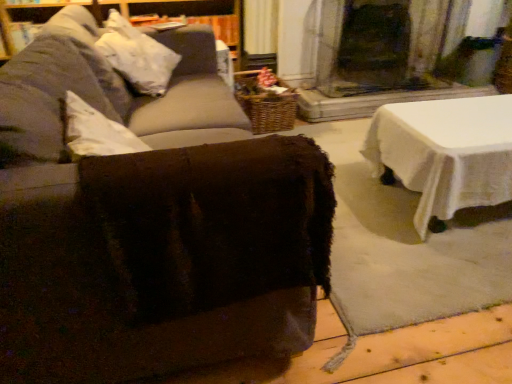
Question: Is white fabric pillow at upper left turned away from brown fuzzy ottoman at center?

Choices:
 (A) no
 (B) yes

Answer: (B)

Question: From the image's perspective, is white fabric pillow at upper left located above brown fuzzy ottoman at center?

Choices:
 (A) yes
 (B) no

Answer: (A)

Question: From the image's perspective, is white fabric pillow at upper left under brown fuzzy ottoman at center?

Choices:
 (A) yes
 (B) no

Answer: (B)

Question: Is white fabric pillow at upper left outside of brown fuzzy ottoman at center?

Choices:
 (A) no
 (B) yes

Answer: (A)

Question: Is white fabric pillow at upper left smaller than brown fuzzy ottoman at center?

Choices:
 (A) yes
 (B) no

Answer: (A)

Question: In terms of height, does white fabric pillow at upper left look taller or shorter compared to woven brown basket at center?

Choices:
 (A) short
 (B) tall

Answer: (B)

Question: Would you say white fabric pillow at upper left is to the left or to the right of woven brown basket at center in the picture?

Choices:
 (A) right
 (B) left

Answer: (B)

Question: From the image's perspective, is white fabric pillow at upper left above or below woven brown basket at center?

Choices:
 (A) below
 (B) above

Answer: (B)

Question: Is white fabric pillow at upper left spatially inside woven brown basket at center, or outside of it?

Choices:
 (A) inside
 (B) outside

Answer: (B)

Question: In the image, is brown fuzzy ottoman at center positioned in front of or behind white fabric pillow at upper left?

Choices:
 (A) behind
 (B) front

Answer: (B)

Question: Is brown fuzzy ottoman at center wider or thinner than white fabric pillow at upper left?

Choices:
 (A) thin
 (B) wide

Answer: (B)

Question: Is brown fuzzy ottoman at center taller or shorter than white fabric pillow at upper left?

Choices:
 (A) short
 (B) tall

Answer: (B)

Question: Considering the positions of point (0, 316) and point (135, 44), is point (0, 316) closer or farther from the camera than point (135, 44)?

Choices:
 (A) farther
 (B) closer

Answer: (B)

Question: In the image, is woven brown basket at center positioned in front of or behind brown fuzzy ottoman at center?

Choices:
 (A) front
 (B) behind

Answer: (B)

Question: Is woven brown basket at center wider or thinner than brown fuzzy ottoman at center?

Choices:
 (A) thin
 (B) wide

Answer: (A)